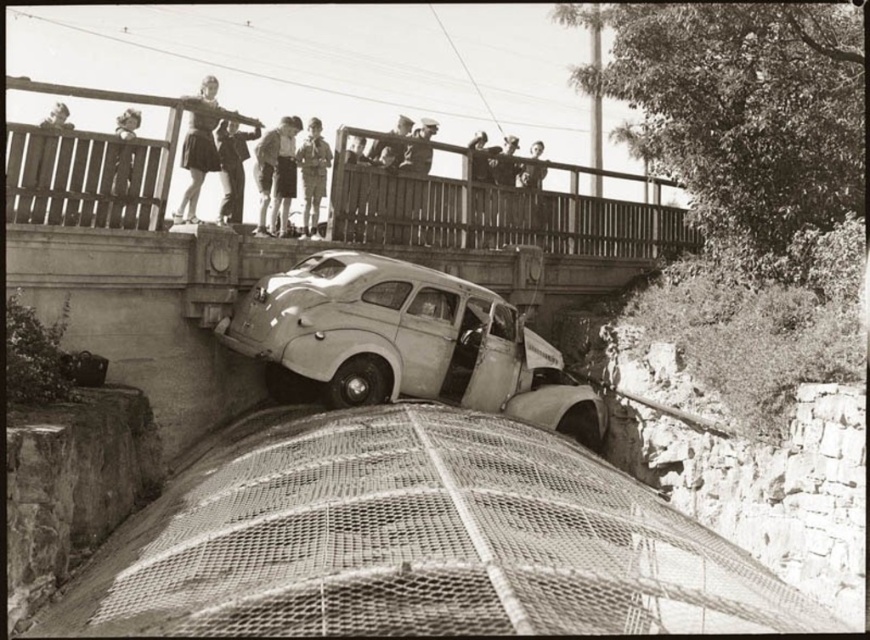
Can you confirm if light skin tone shorts at upper center is shorter than light brown leather jacket at upper center?

No.

Which is below, light skin tone shorts at upper center or light brown leather jacket at upper center?

light brown leather jacket at upper center

Does point (209, 112) come farther from viewer compared to point (219, 221)?

No.

At what (x,y) coordinates should I click in order to perform the action: click on light skin tone shorts at upper center. Please return your answer as a coordinate pair (x, y). The image size is (870, 640). Looking at the image, I should click on (199, 147).

Is light beige matte car at center closer to camera compared to light brown uniform at center?

Yes, light beige matte car at center is in front of light brown uniform at center.

Does light beige matte car at center appear under light brown uniform at center?

Correct, light beige matte car at center is located below light brown uniform at center.

What do you see at coordinates (407, 340) in the screenshot? I see `light beige matte car at center` at bounding box center [407, 340].

Locate an element on the screen. light beige matte car at center is located at coordinates [407, 340].

Is light brown leather jacket at upper center to the left of smooth wooden fence at upper left from the viewer's perspective?

In fact, light brown leather jacket at upper center is to the right of smooth wooden fence at upper left.

Between point (226, 129) and point (68, 152), which one is positioned in front?

Point (68, 152) is in front.

Identify the location of light brown leather jacket at upper center. The width and height of the screenshot is (870, 640). (232, 168).